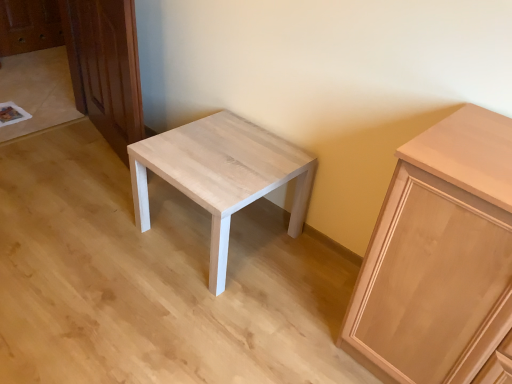
Question: From the image's perspective, relative to light brown wood dresser at left, is light brown wood cabinet at right above or below?

Choices:
 (A) above
 (B) below

Answer: (B)

Question: Is light brown wood cabinet at right taller or shorter than light brown wood dresser at left?

Choices:
 (A) tall
 (B) short

Answer: (B)

Question: Considering the real-world distances, which object is farthest from the light brown wood dresser at left?

Choices:
 (A) light brown wood cabinet at right
 (B) light wood/texture stool at center

Answer: (A)

Question: Which object is the farthest from the light brown wood dresser at left?

Choices:
 (A) light wood/texture stool at center
 (B) light brown wood cabinet at right

Answer: (B)